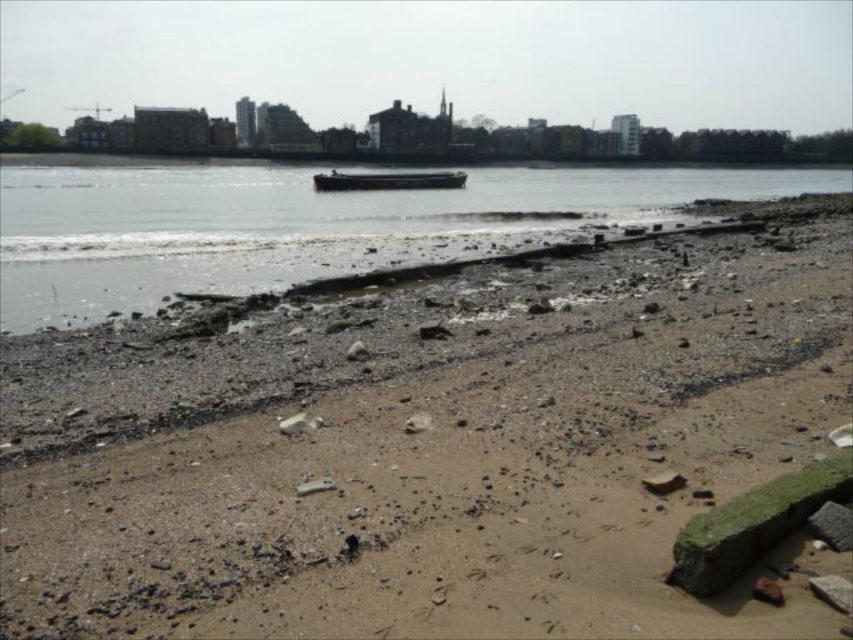
Question: Considering the relative positions of smooth water at center and dark gray metallic barge at center in the image provided, where is smooth water at center located with respect to dark gray metallic barge at center?

Choices:
 (A) below
 (B) above

Answer: (A)

Question: Does brown sandy beach at lower center have a larger size compared to dark gray metallic barge at center?

Choices:
 (A) yes
 (B) no

Answer: (B)

Question: Can you confirm if brown sandy beach at lower center is positioned below dark gray metallic barge at center?

Choices:
 (A) yes
 (B) no

Answer: (A)

Question: Which of the following is the closest to the observer?

Choices:
 (A) (659, 305)
 (B) (370, 230)
 (C) (450, 186)

Answer: (A)

Question: Which point appears closest to the camera in this image?

Choices:
 (A) (320, 177)
 (B) (426, 240)
 (C) (4, 522)

Answer: (C)

Question: Considering the real-world distances, which object is farthest from the dark gray metallic barge at center?

Choices:
 (A) brown sandy beach at lower center
 (B) smooth water at center

Answer: (A)